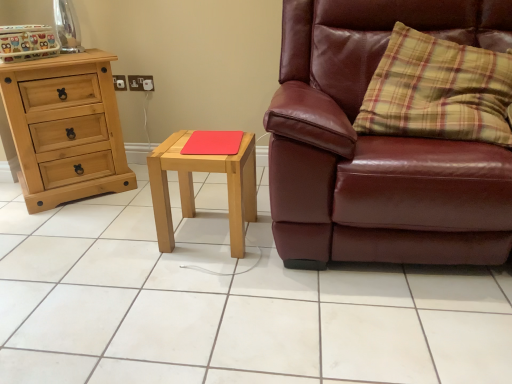
Question: Should I look upward or downward to see light wood/matte nightstand at center?

Choices:
 (A) up
 (B) down

Answer: (A)

Question: Would you say leather couch at right contains white glossy tile at center?

Choices:
 (A) yes
 (B) no

Answer: (B)

Question: Is leather couch at right behind white glossy tile at center?

Choices:
 (A) no
 (B) yes

Answer: (B)

Question: Considering the relative positions of leather couch at right and white glossy tile at center in the image provided, is leather couch at right to the right of white glossy tile at center from the viewer's perspective?

Choices:
 (A) yes
 (B) no

Answer: (A)

Question: Does leather couch at right have a smaller size compared to white glossy tile at center?

Choices:
 (A) no
 (B) yes

Answer: (A)

Question: From the image's perspective, does leather couch at right appear higher than white glossy tile at center?

Choices:
 (A) yes
 (B) no

Answer: (A)

Question: Are leather couch at right and white glossy tile at center far apart?

Choices:
 (A) yes
 (B) no

Answer: (B)

Question: Can we say natural wood chest of drawers at left lies outside red matte mousepad at center?

Choices:
 (A) yes
 (B) no

Answer: (A)

Question: Is red matte mousepad at center surrounded by natural wood chest of drawers at left?

Choices:
 (A) yes
 (B) no

Answer: (B)

Question: Considering the relative sizes of natural wood chest of drawers at left and red matte mousepad at center in the image provided, is natural wood chest of drawers at left wider than red matte mousepad at center?

Choices:
 (A) no
 (B) yes

Answer: (B)

Question: Can you confirm if natural wood chest of drawers at left is thinner than red matte mousepad at center?

Choices:
 (A) yes
 (B) no

Answer: (B)

Question: Could you tell me if natural wood chest of drawers at left is turned towards red matte mousepad at center?

Choices:
 (A) yes
 (B) no

Answer: (A)

Question: Considering the relative sizes of natural wood chest of drawers at left and red matte mousepad at center in the image provided, is natural wood chest of drawers at left bigger than red matte mousepad at center?

Choices:
 (A) no
 (B) yes

Answer: (B)

Question: Does white glossy tile at center appear on the right side of light wood/matte nightstand at center?

Choices:
 (A) yes
 (B) no

Answer: (B)